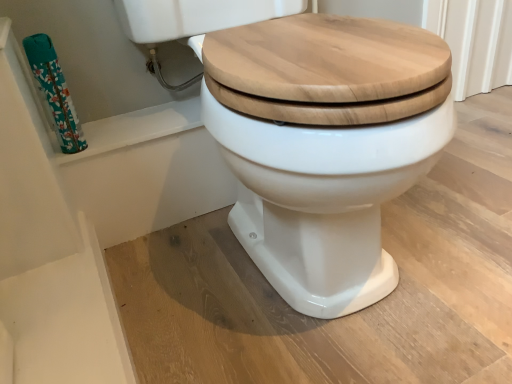
You are a GUI agent. You are given a task and a screenshot of the screen. Output one action in this format:
    pyautogui.click(x=<x>, y=<y>)
    Task: Click on the vacant space to the right of teal floral-patterned toilet paper at left
    
    Given the screenshot: What is the action you would take?
    pyautogui.click(x=143, y=127)